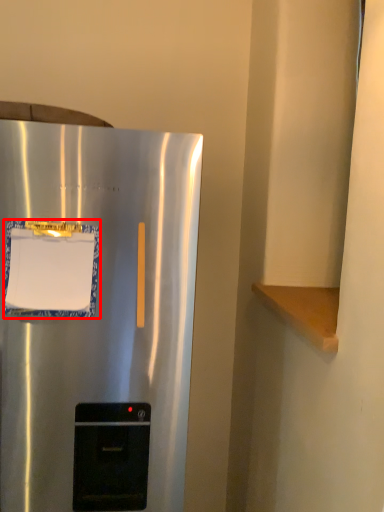
Question: Where is paper (annotated by the red box) located in relation to refrigerator in the image?

Choices:
 (A) right
 (B) left

Answer: (A)